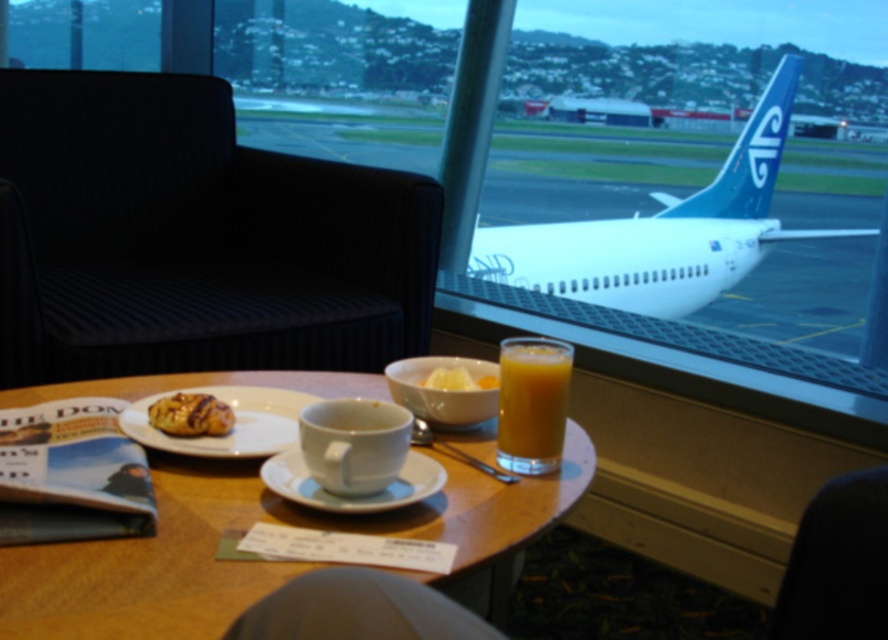
You are a flight attendant preparing to serve drinks and snacks on an airplane. You have a translucent glass juice at center and a yellow creamy spread at center on the table. Which item should you pick up first if you want to serve the larger one to the passengers?

The translucent glass juice at center is larger than the yellow creamy spread at center, so you should pick up the translucent glass juice at center first to serve the larger one to the passengers.

In the scene shown: You are sitting at the wooden table in the airport lounge and want to move your phone to the black fabric armchair at left. The coordinates of the point where you want to place your phone are given as point (193, 237). Is this point located on the black fabric armchair at left?

Yes, the point (193, 237) is on the black fabric armchair at left, so you can place your phone there.

You are a flight attendant preparing to serve drinks and snacks. You have a tray with both the translucent glass juice at center and the yellow creamy spread at center. Which container requires more space on the tray to prevent spilling or sloshing?

The translucent glass juice at center might be wider than yellow creamy spread at center, so it requires more space on the tray to prevent spilling or sloshing.